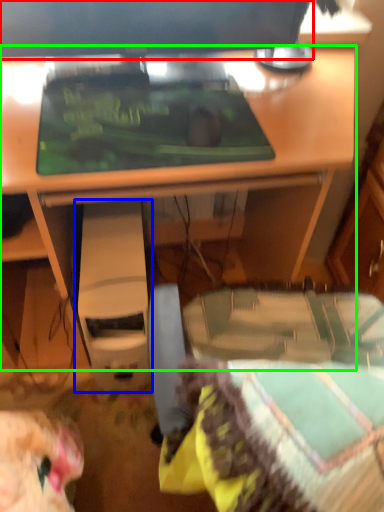
Question: Which object is positioned closest to computer monitor (highlighted by a red box)? Select from computer (highlighted by a blue box) and desk (highlighted by a green box).

Choices:
 (A) computer
 (B) desk

Answer: (B)